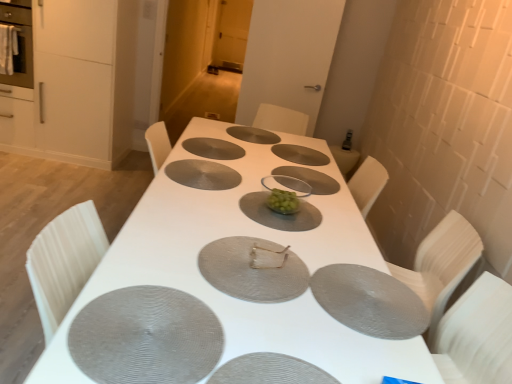
The height and width of the screenshot is (384, 512). Identify the location of vacant area that is in front of metallic silver pizza pan at center, positioned as the 5th pizza pan in back-to-front order. (283, 325).